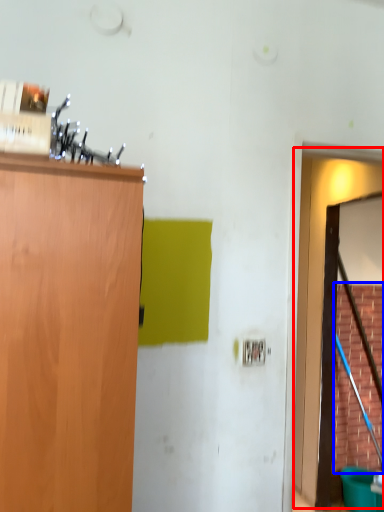
Question: Which object is further to the camera taking this photo, door (highlighted by a red box) or plywood (highlighted by a blue box)?

Choices:
 (A) door
 (B) plywood

Answer: (B)